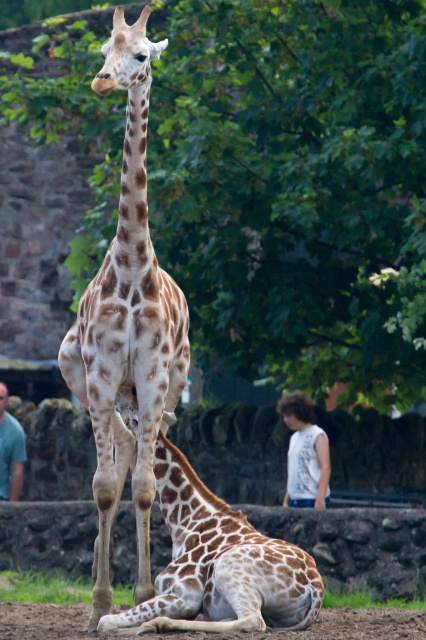
You are standing at the point marked by coordinates point (x=184, y=522). You want to walk towards the entrance of the zoo, which is located 50 feet away from your current position. How far will you have to walk to reach the entrance?

You are currently 30.54 feet away from the entrance. Since the entrance is 50 feet away from your current position, you will need to walk an additional 19.46 feet to reach it.

You are a zookeeper who needs to place a new feeding station between the green leafy tree at upper center and the blue shirt at lower left. Based on their positions, which object is higher up in the image?

The green leafy tree at upper center is located above the blue shirt at lower left, so the green leafy tree at upper center is higher up in the image.